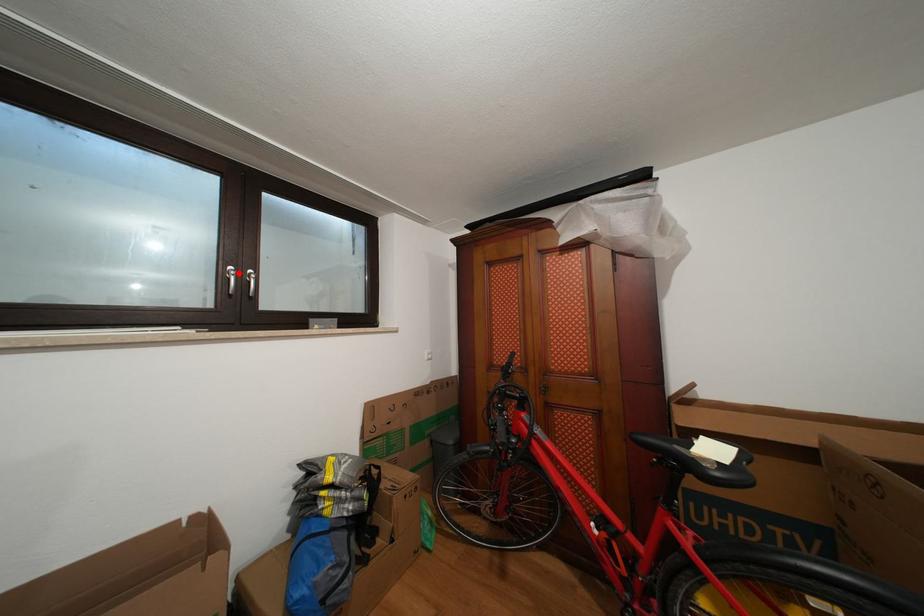
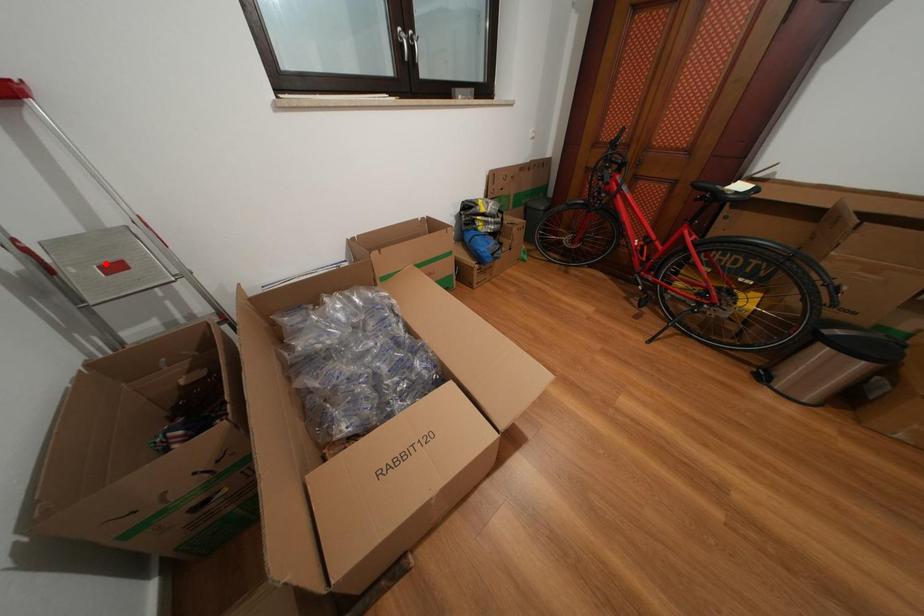
I am providing you with two images of the same scene from different viewpoints. A red point is marked on the first image and another point is marked on the second image. Is the red point in image1 aligned with the point shown in image2?

No